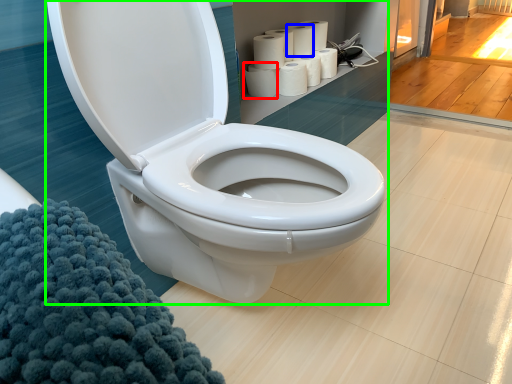
Question: Considering the real-world distances, which object is closest to paper towel (highlighted by a red box)? paper towel (highlighted by a blue box) or toilet (highlighted by a green box).

Choices:
 (A) paper towel
 (B) toilet

Answer: (A)